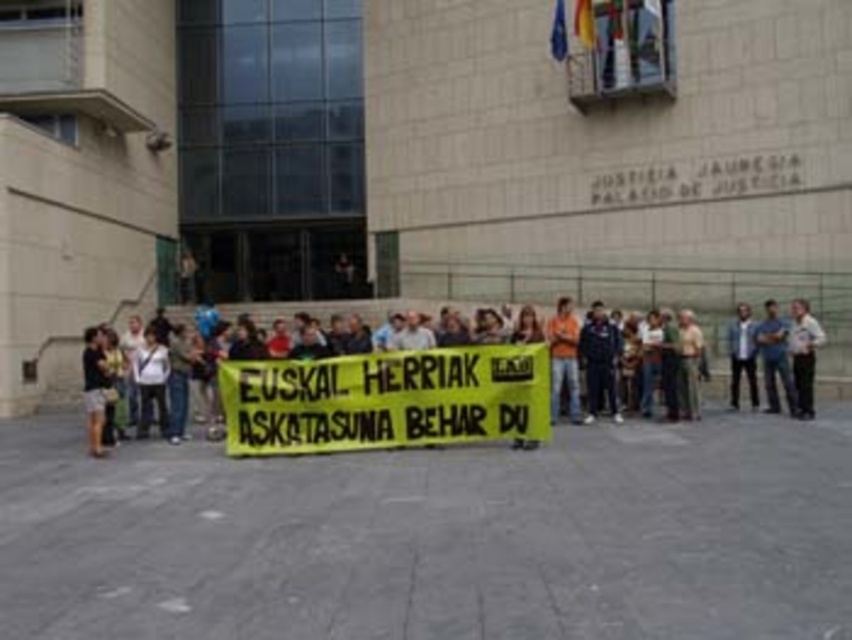
Question: In this image, where is yellow fabric banner at center located relative to denim jacket at center?

Choices:
 (A) left
 (B) right

Answer: (A)

Question: From the image, what is the correct spatial relationship of light brown leather jacket at center in relation to denim jacket at center?

Choices:
 (A) left
 (B) right

Answer: (B)

Question: Among these points, which one is nearest to the camera?

Choices:
 (A) (790, 401)
 (B) (746, 330)
 (C) (799, 417)
 (D) (194, 356)

Answer: (D)

Question: Can you confirm if yellow fabric banner at center is positioned to the left of dark blue jeans at center?

Choices:
 (A) yes
 (B) no

Answer: (A)

Question: Which point is closer to the camera?

Choices:
 (A) light brown leather jacket at center
 (B) yellow fabric banner at center

Answer: (B)

Question: Which point is closer to the camera?

Choices:
 (A) (744, 349)
 (B) (774, 348)
 (C) (493, 339)

Answer: (C)